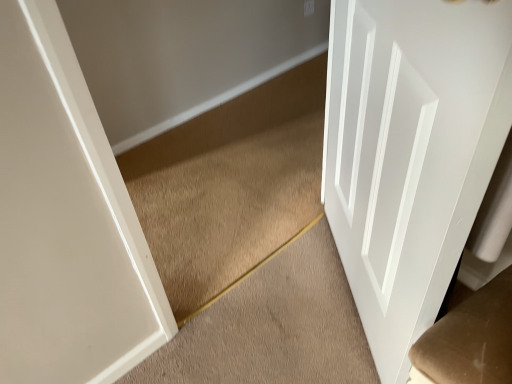
Question: Can carpet at center be found inside white glossy door at right?

Choices:
 (A) no
 (B) yes

Answer: (A)

Question: Does white glossy door at right have a greater height compared to carpet at center?

Choices:
 (A) no
 (B) yes

Answer: (B)

Question: Are white glossy door at right and carpet at center making contact?

Choices:
 (A) no
 (B) yes

Answer: (A)

Question: Could you tell me if white glossy door at right is facing carpet at center?

Choices:
 (A) yes
 (B) no

Answer: (A)

Question: From the image's perspective, is white glossy door at right on top of carpet at center?

Choices:
 (A) yes
 (B) no

Answer: (A)

Question: Is white glossy door at right not within carpet at center?

Choices:
 (A) no
 (B) yes

Answer: (B)

Question: Considering the relative positions of carpet at center and white glossy door at right in the image provided, is carpet at center to the right of white glossy door at right from the viewer's perspective?

Choices:
 (A) yes
 (B) no

Answer: (B)

Question: Is carpet at center in front of white glossy door at right?

Choices:
 (A) no
 (B) yes

Answer: (A)

Question: Could you tell me if carpet at center is facing white glossy door at right?

Choices:
 (A) yes
 (B) no

Answer: (B)

Question: Is carpet at center next to white glossy door at right and touching it?

Choices:
 (A) no
 (B) yes

Answer: (A)

Question: Is the position of carpet at center more distant than that of white glossy door at right?

Choices:
 (A) no
 (B) yes

Answer: (B)

Question: Can you confirm if carpet at center is positioned to the left of white glossy door at right?

Choices:
 (A) no
 (B) yes

Answer: (B)

Question: Is point (196, 375) closer or farther from the camera than point (432, 198)?

Choices:
 (A) closer
 (B) farther

Answer: (B)